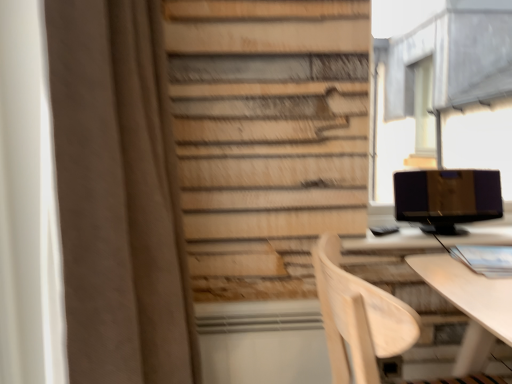
Question: Is brown fabric curtain at left inside or outside of light wood chair at lower right?

Choices:
 (A) inside
 (B) outside

Answer: (B)

Question: Considering the positions of point (119, 54) and point (345, 294), is point (119, 54) closer or farther from the camera than point (345, 294)?

Choices:
 (A) farther
 (B) closer

Answer: (A)

Question: Which is farther from the metallic gray bay window at upper right?

Choices:
 (A) matte black monitor at right
 (B) brown fabric curtain at left
 (C) light wood chair at lower right

Answer: (C)

Question: Estimate the real-world distances between objects in this image. Which object is farther from the matte black monitor at right?

Choices:
 (A) light wood chair at lower right
 (B) brown fabric curtain at left
 (C) metallic gray bay window at upper right

Answer: (C)